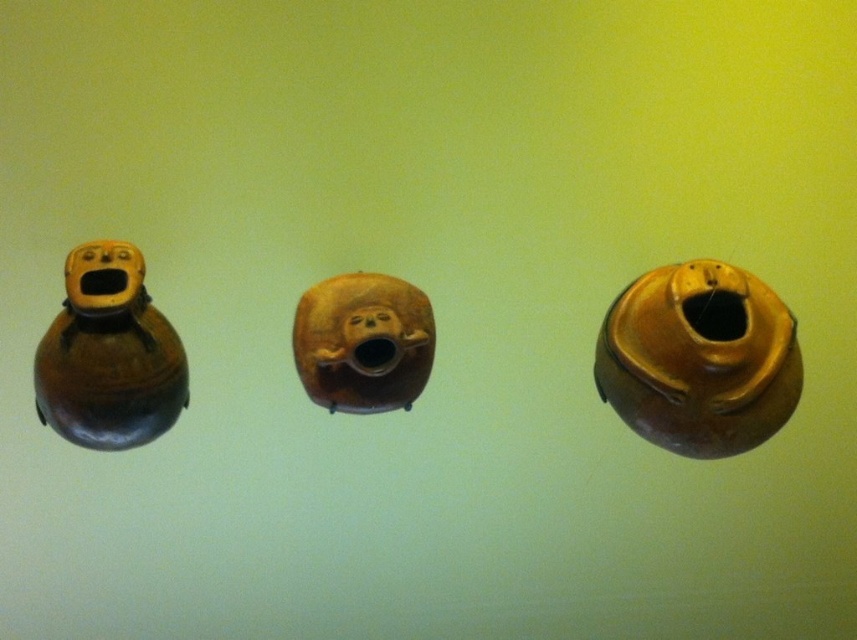
You are standing in front of the three vessels. There are two points marked on the image. One is at coordinates point (754, 336) and the other at point (321, 348). Which point is closer to you?

Point (754, 336) is in front of point (321, 348), so it is closer to you.

You are an archaeologist examining three ancient ceramic vessels arranged horizontally. You notice the matte brown vase at center and the matte brown vase at left. Based on their arrangement, can you determine which one has a greater width?

The matte brown vase at center might be wider than matte brown vase at left according to the description.

You are an archaeologist examining the vessels. Based on their arrangement, which vessel would you estimate to be the tallest when comparing the matte brown vase at left and the matte brown vase at center?

The matte brown vase at left is taller than the matte brown vase at center.